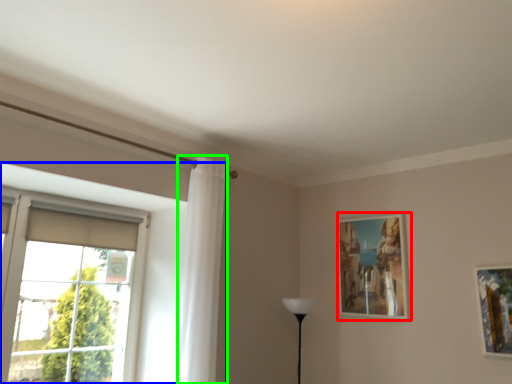
Question: Which is nearer to the picture frame (highlighted by a red box)? window (highlighted by a blue box) or curtain (highlighted by a green box).

Choices:
 (A) window
 (B) curtain

Answer: (B)